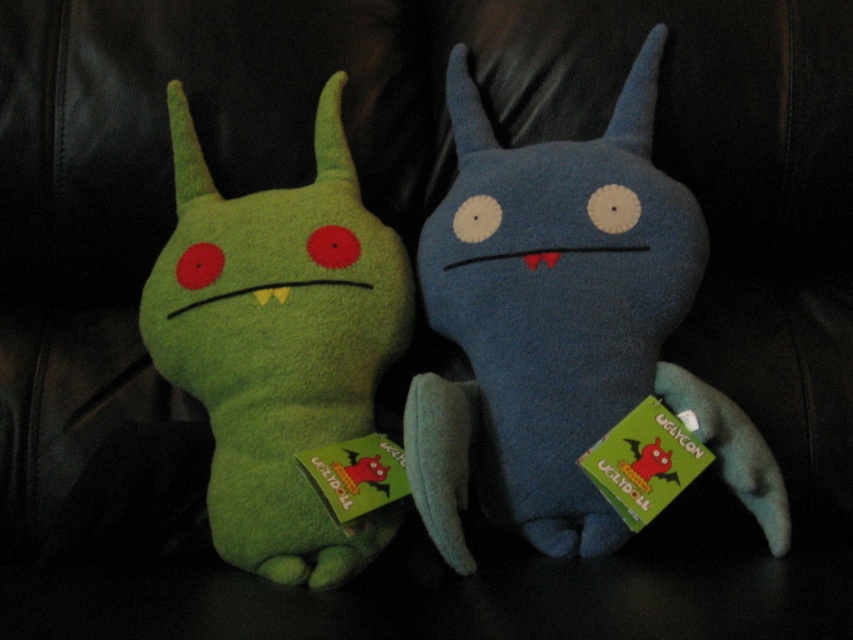
Looking at this image, between blue plush toy at center and green plush toy at left, which one is positioned lower?

Positioned lower is green plush toy at left.

Consider the image. Is blue plush toy at center above green plush toy at left?

Indeed, blue plush toy at center is positioned over green plush toy at left.

Between point (758, 476) and point (294, 189), which one is positioned in front?

Point (758, 476) is more forward.

In order to click on blue plush toy at center in this screenshot , I will do `click(561, 326)`.